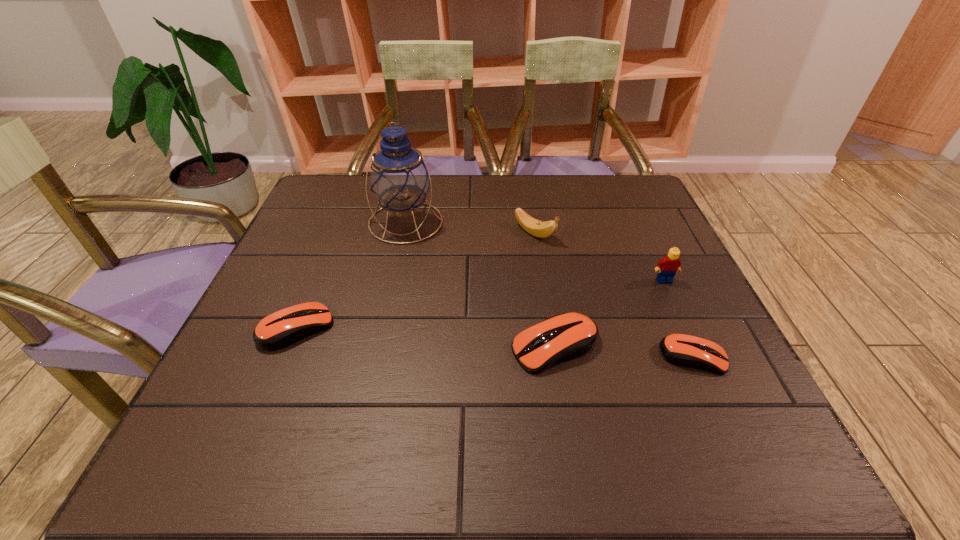
Locate an element on the screen. The image size is (960, 540). the second tallest computer mouse is located at coordinates (285, 327).

The image size is (960, 540). In order to click on the leftmost computer mouse in this screenshot , I will do `click(285, 327)`.

Identify the location of the second computer mouse from right to left. (567, 336).

You are a GUI agent. You are given a task and a screenshot of the screen. Output one action in this format:
    pyautogui.click(x=<x>, y=<y>)
    Task: Click on the shortest object
    This screenshot has width=960, height=540.
    Given the screenshot: What is the action you would take?
    pyautogui.click(x=683, y=350)

Locate an element on the screen. This screenshot has height=540, width=960. the shortest computer mouse is located at coordinates (683, 350).

Identify the location of the second object from left to right. (399, 178).

The height and width of the screenshot is (540, 960). What are the coordinates of `the tallest object` in the screenshot? It's located at (399, 178).

Locate an element on the screen. This screenshot has height=540, width=960. banana is located at coordinates (542, 229).

In order to click on the fourth nearest object in this screenshot , I will do `click(667, 267)`.

Where is `free space located on the right of the second shortest object`? free space located on the right of the second shortest object is located at coordinates (362, 328).